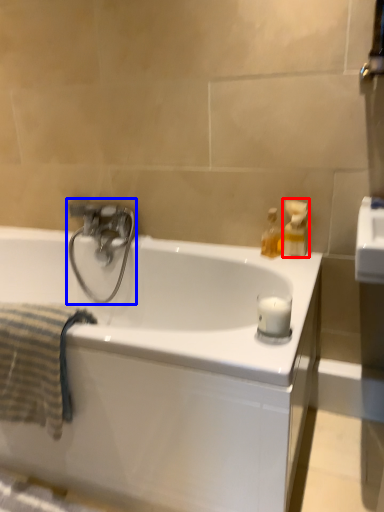
Question: Which point is further to the camera, soap dispenser (highlighted by a red box) or tap (highlighted by a blue box)?

Choices:
 (A) soap dispenser
 (B) tap

Answer: (B)